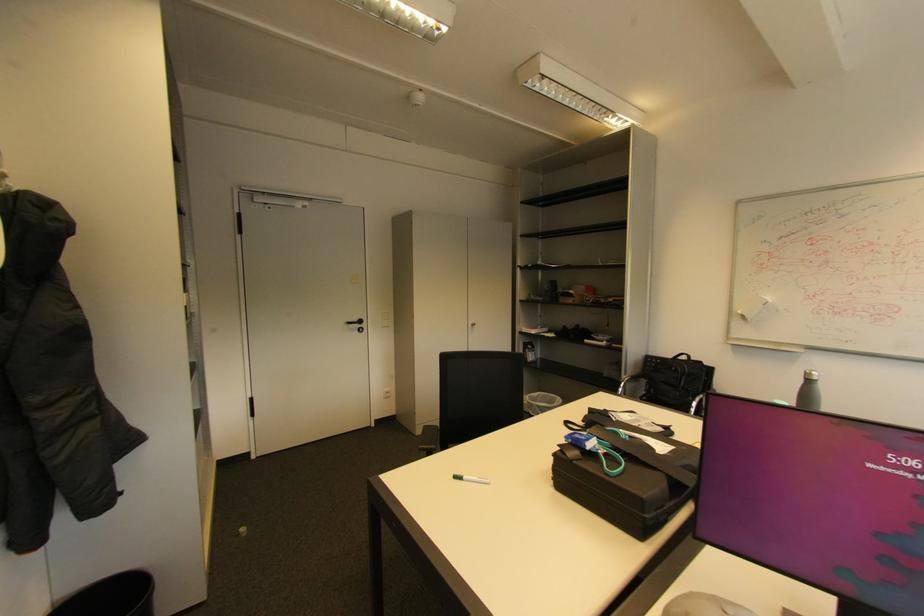
Where is `black trash can`? The image size is (924, 616). black trash can is located at coordinates (112, 596).